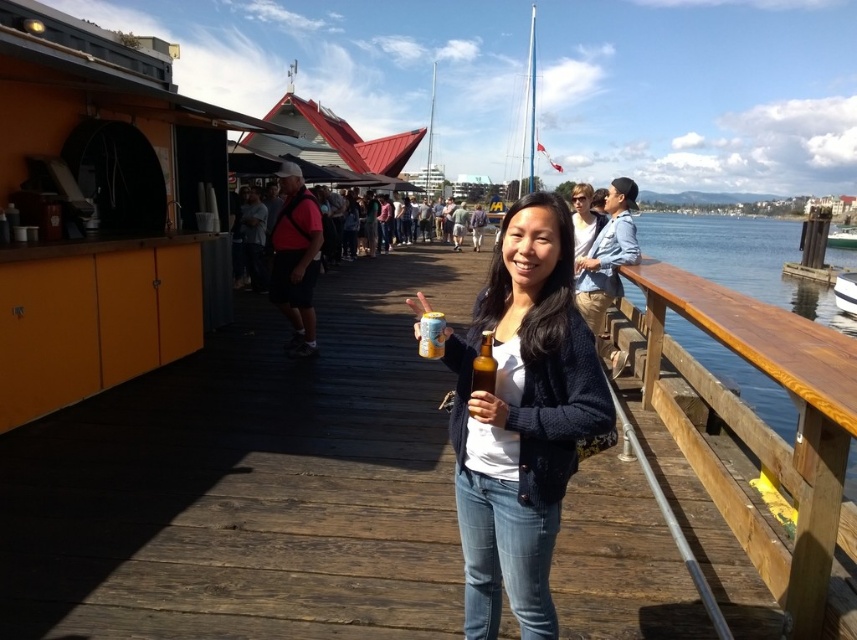
Question: Can you confirm if wooden deck at center is positioned above white sailboat at upper center?

Choices:
 (A) no
 (B) yes

Answer: (A)

Question: Which object is positioned farthest from the white glossy boat at upper right?

Choices:
 (A) wooden rail at right
 (B) knit sweater at center
 (C) yellow matte can at center

Answer: (C)

Question: Considering the real-world distances, which object is farthest from the wooden rail at right?

Choices:
 (A) white sailboat at upper center
 (B) knit sweater at center
 (C) brown glass bottle at center
 (D) yellow matte can at center

Answer: (A)

Question: In this image, where is wooden deck at center located relative to white glossy boat at upper right?

Choices:
 (A) below
 (B) above

Answer: (A)

Question: Observing the image, what is the correct spatial positioning of wooden deck at center in reference to white glossy boat at upper right?

Choices:
 (A) right
 (B) left

Answer: (B)

Question: Which of the following is the closest to the observer?

Choices:
 (A) (644, 499)
 (B) (854, 625)
 (C) (529, 106)
 (D) (546, 464)

Answer: (D)